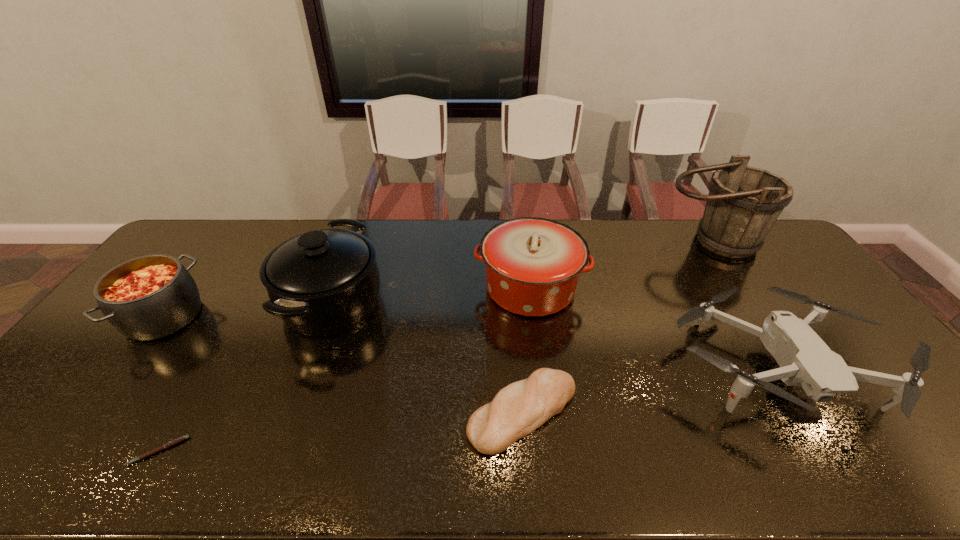
I want to click on free spot at the left edge of the desktop, so click(97, 378).

Image resolution: width=960 pixels, height=540 pixels. In the image, there is a desktop. In order to click on free space at the right edge in this screenshot , I will do `click(853, 349)`.

This screenshot has height=540, width=960. I want to click on free space at the far left corner of the desktop, so click(209, 258).

Where is `unoccupied area between the bucket and the shortest object`? This screenshot has width=960, height=540. unoccupied area between the bucket and the shortest object is located at coordinates (434, 346).

Find the location of a particular element. The width and height of the screenshot is (960, 540). vacant point located between the bread and the shortest object is located at coordinates (341, 432).

Image resolution: width=960 pixels, height=540 pixels. What are the coordinates of `unoccupied position between the drone and the fifth object from right to left` in the screenshot? It's located at (554, 334).

Identify the location of vacant space that is in between the second shortest object and the drone. This screenshot has width=960, height=540. (649, 390).

In order to click on unoccupied area between the drone and the fifth shortest object in this screenshot , I will do `click(653, 328)`.

Where is `vacant area that lies between the saucepan and the bread`? The image size is (960, 540). vacant area that lies between the saucepan and the bread is located at coordinates (427, 357).

Where is `free space between the drone and the second shortest object`? free space between the drone and the second shortest object is located at coordinates (649, 390).